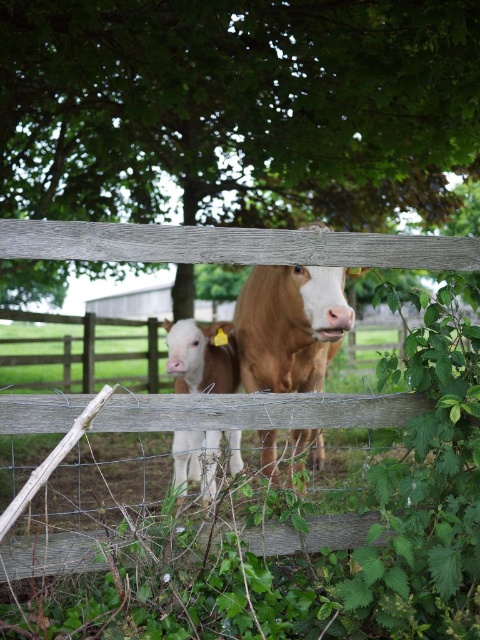
Can you confirm if green leafy tree at upper center is thinner than white smooth calf at center?

No, green leafy tree at upper center is not thinner than white smooth calf at center.

Which is more to the right, green leafy tree at upper center or white smooth calf at center?

green leafy tree at upper center is more to the right.

Is point (72, 77) closer to viewer compared to point (217, 442)?

No, (72, 77) is further to viewer.

Identify the location of green leafy tree at upper center. The image size is (480, 640). (236, 108).

Does green leafy tree at upper center appear under brown matte cow at center?

Incorrect, green leafy tree at upper center is not positioned below brown matte cow at center.

Who is positioned more to the right, green leafy tree at upper center or brown matte cow at center?

Positioned to the right is brown matte cow at center.

Is point (211, 180) behind point (320, 444)?

Yes, point (211, 180) is farther from viewer.

This screenshot has height=640, width=480. I want to click on green leafy tree at upper center, so click(x=236, y=108).

Who is taller, brown matte cow at center or white smooth calf at center?

With more height is brown matte cow at center.

Is brown matte cow at center in front of white smooth calf at center?

No, brown matte cow at center is behind white smooth calf at center.

The width and height of the screenshot is (480, 640). In order to click on brown matte cow at center in this screenshot , I will do `click(289, 324)`.